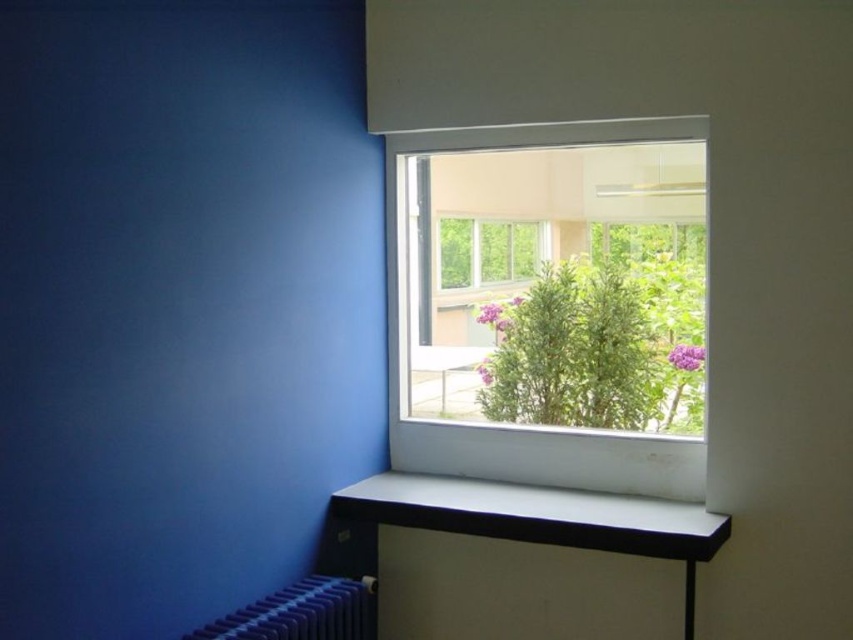
You are a delivery robot with a package that is 12 inches long. You need to place it on the surface between the green leafy plant at center and the white plastic window at upper center. Will the package fit between them without overlapping either object?

The distance between the green leafy plant at center and the white plastic window at upper center is 12.37 inches. Since the package is 12 inches long, it will fit between them without overlapping either object.

You are trying to place a small potted plant on the white glossy window sill at lower center. However, you also want to ensure that the clear glass window at center remains mostly visible. Based on their sizes, will the window sill be able to hold the plant without blocking the view through the window?

The white glossy window sill at lower center is shorter than the clear glass window at center, so placing the potted plant on the sill will not significantly block the view through the window since the sill is smaller in size compared to the window.